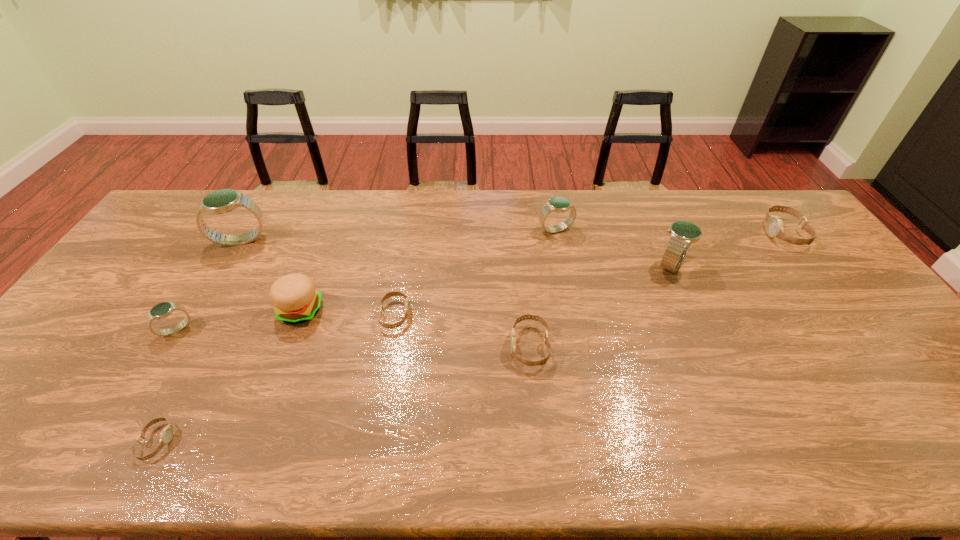
Locate which watch ranks fifth in proximity to the tallest object. Please provide its 2D coordinates. Your answer should be formatted as a tuple, i.e. [(x, y)], where the tuple contains the x and y coordinates of a point satisfying the conditions above.

[(556, 204)]

Identify which blue watch is the third nearest to the seventh tallest watch. Please provide its 2D coordinates. Your answer should be formatted as a tuple, i.e. [(x, y)], where the tuple contains the x and y coordinates of a point satisfying the conditions above.

[(162, 310)]

Point out which blue watch is positioned as the third nearest to the smallest blue watch. Please provide its 2D coordinates. Your answer should be formatted as a tuple, i.e. [(x, y)], where the tuple contains the x and y coordinates of a point satisfying the conditions above.

[(682, 233)]

Select which beige watch is the third closest to the rightmost beige watch. Please provide its 2D coordinates. Your answer should be formatted as a tuple, i.e. [(x, y)], where the tuple contains the x and y coordinates of a point satisfying the conditions above.

[(166, 435)]

Locate which beige watch is the second closest to the rightmost blue watch. Please provide its 2D coordinates. Your answer should be formatted as a tuple, i.e. [(x, y)], where the tuple contains the x and y coordinates of a point satisfying the conditions above.

[(541, 362)]